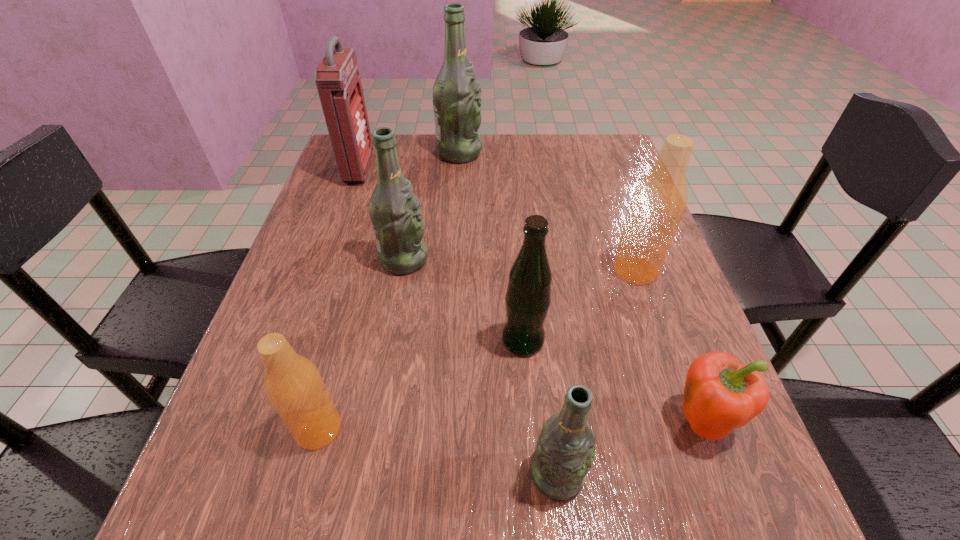
You are a GUI agent. You are given a task and a screenshot of the screen. Output one action in this format:
    pyautogui.click(x=<x>, y=<y>)
    Task: Click on the vacant space that satisfies the following two spatial constraints: 1. on the back side of the shortest object; 2. on the surface of the biggest green beer bottle
    
    Given the screenshot: What is the action you would take?
    pyautogui.click(x=603, y=153)

At what (x,y) coordinates should I click in order to perform the action: click on vacant point that satisfies the following two spatial constraints: 1. on the surface of the orange pepper; 2. on the right side of the farthest green beer bottle. Please return your answer as a coordinate pair (x, y). This screenshot has height=540, width=960. Looking at the image, I should click on (443, 421).

Identify the location of vacant space that satisfies the following two spatial constraints: 1. on the front-facing side of the red first-aid kit; 2. on the right side of the pepper. (273, 421).

Locate an element on the screen. The width and height of the screenshot is (960, 540). vacant space that satisfies the following two spatial constraints: 1. on the surface of the shortest object; 2. on the right side of the third nearest green beer bottle is located at coordinates [375, 421].

Where is `free space that satisfies the following two spatial constraints: 1. on the surface of the farthest beer bottle; 2. on the right side of the third farthest green beer bottle`? This screenshot has height=540, width=960. free space that satisfies the following two spatial constraints: 1. on the surface of the farthest beer bottle; 2. on the right side of the third farthest green beer bottle is located at coordinates coord(447,341).

This screenshot has width=960, height=540. Find the location of `free space that satisfies the following two spatial constraints: 1. on the surface of the fourth nearest object; 2. on the right side of the tallest beer bottle`. free space that satisfies the following two spatial constraints: 1. on the surface of the fourth nearest object; 2. on the right side of the tallest beer bottle is located at coordinates (447, 341).